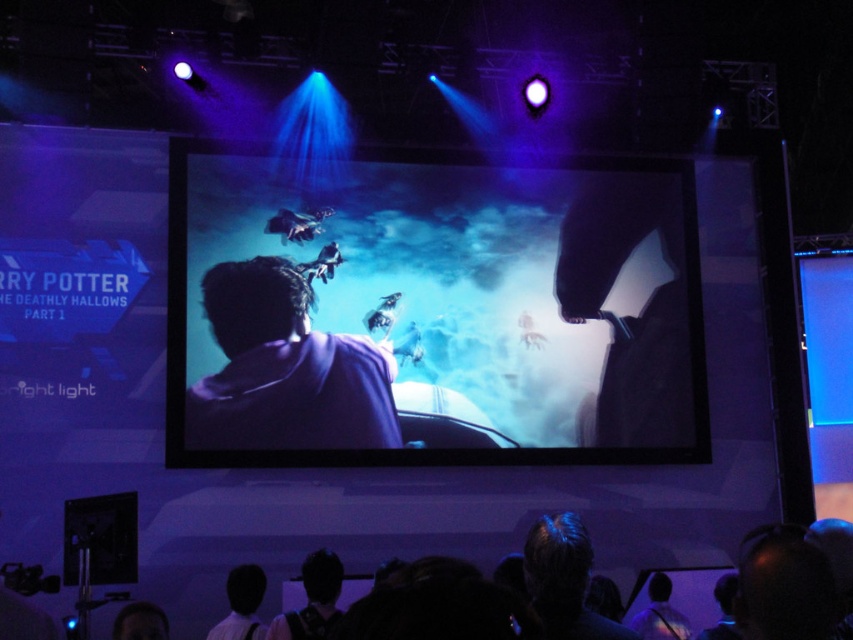
Can you confirm if matte black screen at center is wider than purple fabric at center?

Correct, the width of matte black screen at center exceeds that of purple fabric at center.

Locate an element on the screen. This screenshot has height=640, width=853. matte black screen at center is located at coordinates (431, 308).

Between point (254, 156) and point (223, 376), which one is positioned behind?

The point (254, 156) is behind.

This screenshot has height=640, width=853. I want to click on matte black screen at center, so click(431, 308).